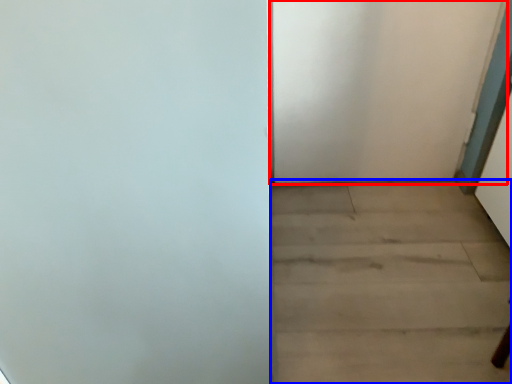
Question: Among these objects, which one is nearest to the camera, door (highlighted by a red box) or stairwell (highlighted by a blue box)?

Choices:
 (A) door
 (B) stairwell

Answer: (B)